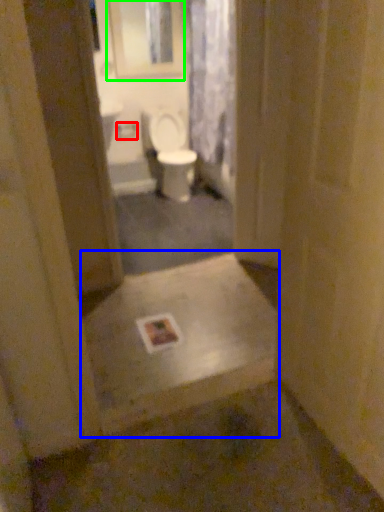
Question: Which object is positioned closest to toilet paper (highlighted by a red box)? Select from landing (highlighted by a blue box) and medicine cabinet (highlighted by a green box).

Choices:
 (A) landing
 (B) medicine cabinet

Answer: (B)